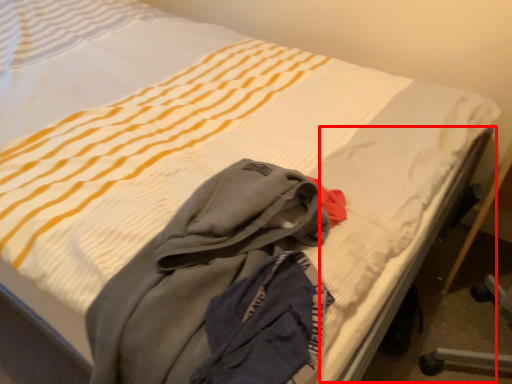
Question: In this image, where is bed frame (annotated by the red box) located relative to laundry?

Choices:
 (A) left
 (B) right

Answer: (B)